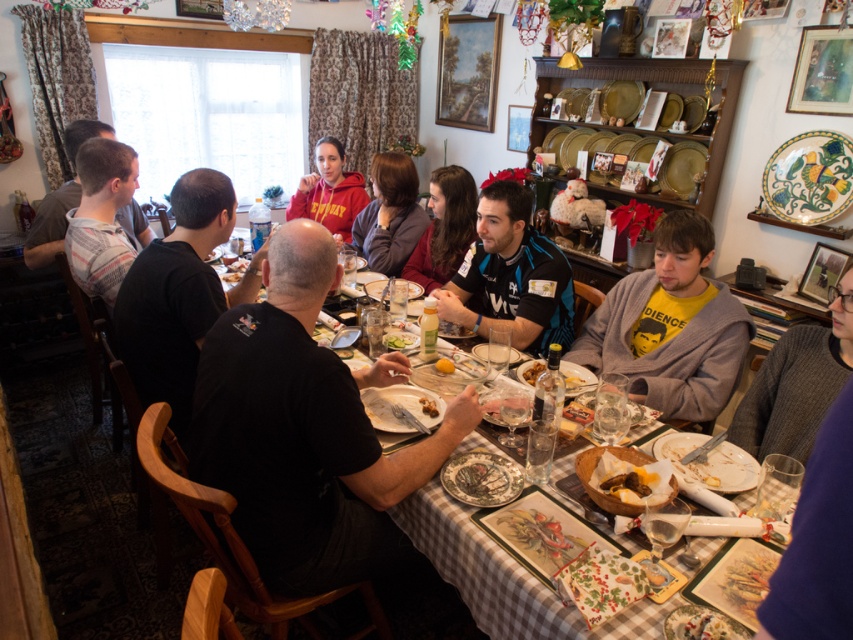
Can you confirm if purple fleece jacket at upper center is bigger than golden-brown bread basket at lower center?

Yes.

Is point (401, 264) farther from camera compared to point (583, 451)?

Yes.

What are the coordinates of `purple fleece jacket at upper center` in the screenshot? It's located at (389, 214).

This screenshot has height=640, width=853. Describe the element at coordinates (178, 292) in the screenshot. I see `black t-shirt at left` at that location.

At what (x,y) coordinates should I click in order to perform the action: click on black t-shirt at left. Please return your answer as a coordinate pair (x, y). This screenshot has height=640, width=853. Looking at the image, I should click on (178, 292).

Looking at this image, can you confirm if striped cotton shirt at left is taller than golden-brown bread basket at lower center?

Yes, striped cotton shirt at left is taller than golden-brown bread basket at lower center.

Does striped cotton shirt at left have a greater width compared to golden-brown bread basket at lower center?

Indeed, striped cotton shirt at left has a greater width compared to golden-brown bread basket at lower center.

The width and height of the screenshot is (853, 640). What do you see at coordinates (102, 218) in the screenshot?
I see `striped cotton shirt at left` at bounding box center [102, 218].

At what (x,y) coordinates should I click in order to perform the action: click on striped cotton shirt at left. Please return your answer as a coordinate pair (x, y). Looking at the image, I should click on (102, 218).